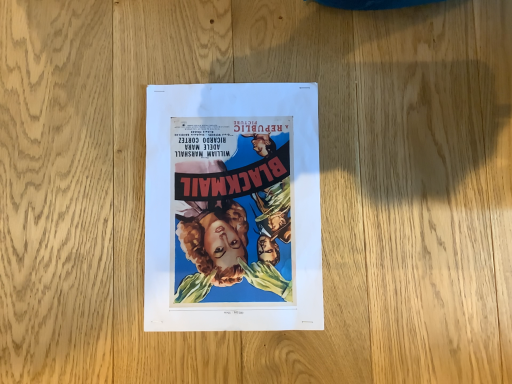
Find the location of a particular element. The image size is (512, 384). matte paper poster at center is located at coordinates (233, 208).

Describe the element at coordinates (233, 208) in the screenshot. This screenshot has height=384, width=512. I see `matte paper poster at center` at that location.

The height and width of the screenshot is (384, 512). I want to click on matte paper poster at center, so click(x=233, y=208).